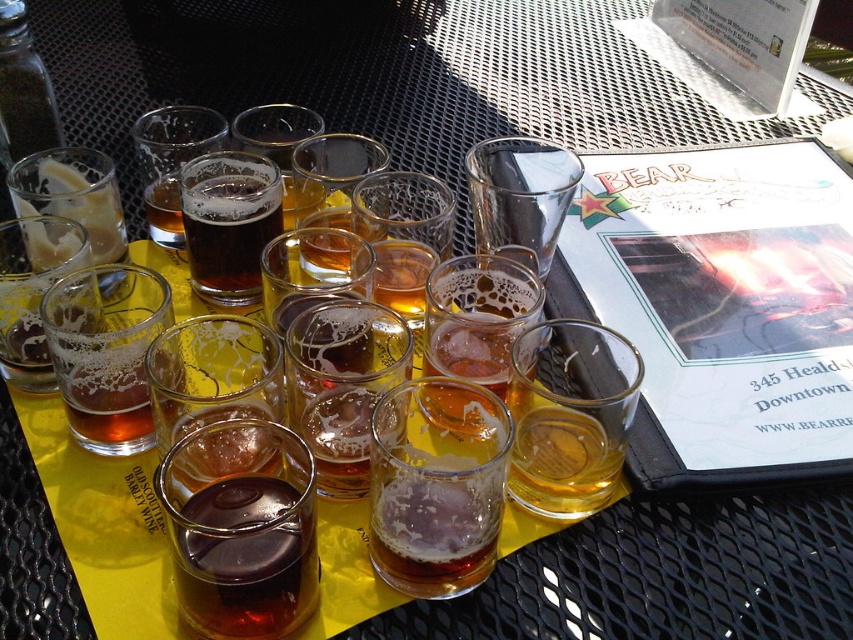
You are at a bar and want to choose a beer glass that can hold more liquid. Based on the glasses shown on the yellow mat, which one would you pick between the translucent amber glass at center and the matte glass beer at center?

The translucent amber glass at center is larger in size than the matte glass beer at center, so it can hold more liquid.

You are a bartender arranging glasses on a yellow mat. You need to place a new glass behind the existing ones. Which glass should you place behind, the clear glass at center or the matte glass beer at center?

You should place the new glass behind the matte glass beer at center because the clear glass at center is already in front of it.

You are standing at the table where the beer glasses are arranged. You need to move from your current position to the point labeled point (558,172). However, there is an obstacle at point (165,285). Will you encounter this obstacle on your way?

Yes, you will encounter the obstacle at point (165,285) because it is in front of point (558,172), meaning it lies along the path towards that point.